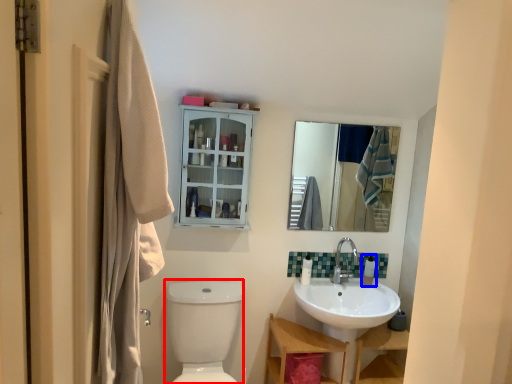
Question: Which object appears farthest to the camera in this image, toilet bowl (highlighted by a red box) or toiletry (highlighted by a blue box)?

Choices:
 (A) toilet bowl
 (B) toiletry

Answer: (B)